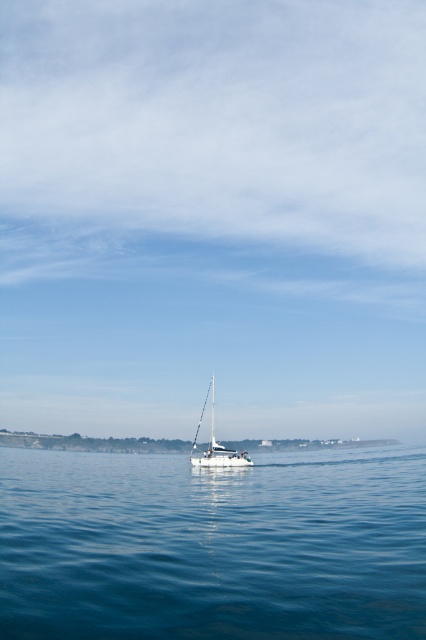
Can you confirm if smooth sand at lower center is positioned to the left of white glossy sailboat at center?

No, smooth sand at lower center is not to the left of white glossy sailboat at center.

Locate an element on the screen. This screenshot has height=640, width=426. smooth sand at lower center is located at coordinates (92, 442).

Where is `smooth sand at lower center`? smooth sand at lower center is located at coordinates (92, 442).

Is transparent glass sailboat at center positioned before blue liquid water at center?

No, it is not.

Can you confirm if transparent glass sailboat at center is bigger than blue liquid water at center?

Yes.

Describe the element at coordinates (213, 214) in the screenshot. This screenshot has height=640, width=426. I see `transparent glass sailboat at center` at that location.

Find the location of a particular element. The width and height of the screenshot is (426, 640). transparent glass sailboat at center is located at coordinates (213, 214).

Is transparent glass sailboat at center closer to camera compared to smooth sand at lower center?

No, it is behind smooth sand at lower center.

Between transparent glass sailboat at center and smooth sand at lower center, which one is positioned lower?

smooth sand at lower center

Where is `transparent glass sailboat at center`? transparent glass sailboat at center is located at coordinates (213, 214).

Locate an element on the screen. The image size is (426, 640). transparent glass sailboat at center is located at coordinates pyautogui.click(x=213, y=214).